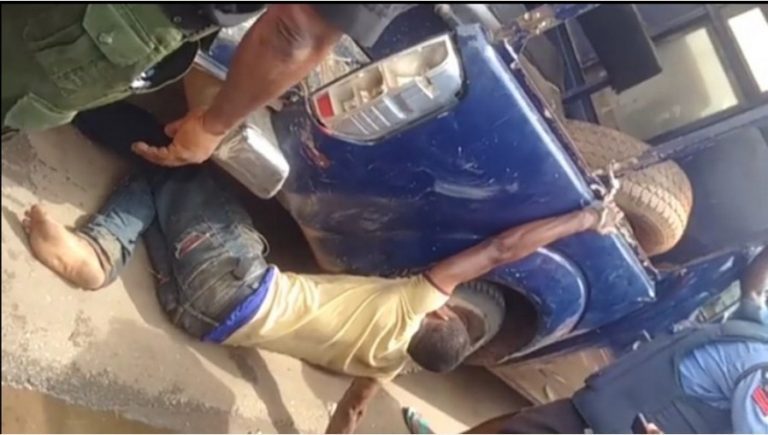
Where is `window`? This screenshot has height=435, width=768. window is located at coordinates (676, 107).